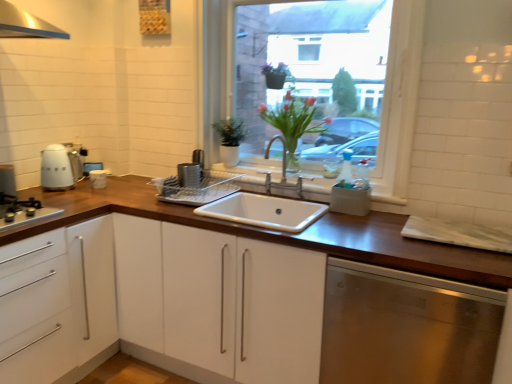
Question: Is white ceramic sink at center at the back of white glossy cabinet at left, placed as the first cabinetry when sorted from left to right?

Choices:
 (A) no
 (B) yes

Answer: (A)

Question: Does white glossy cabinet at left, the 2th cabinetry viewed from the right, lie in front of white ceramic sink at center?

Choices:
 (A) yes
 (B) no

Answer: (A)

Question: Considering the relative sizes of white glossy cabinet at left, the 2th cabinetry viewed from the right, and white ceramic sink at center in the image provided, is white glossy cabinet at left, the 2th cabinetry viewed from the right, wider than white ceramic sink at center?

Choices:
 (A) yes
 (B) no

Answer: (A)

Question: Is white glossy cabinet at left, the 2th cabinetry viewed from the right, completely or partially outside of white ceramic sink at center?

Choices:
 (A) no
 (B) yes

Answer: (B)

Question: Does white glossy cabinet at left, the 2th cabinetry viewed from the right, have a lesser height compared to white ceramic sink at center?

Choices:
 (A) yes
 (B) no

Answer: (B)

Question: From the image's perspective, does white glossy cabinet at left, the 2th cabinetry viewed from the right, appear lower than white ceramic sink at center?

Choices:
 (A) no
 (B) yes

Answer: (B)

Question: Is translucent glass vase at center facing towards white glossy cabinet at left, the 2th cabinetry viewed from the right?

Choices:
 (A) no
 (B) yes

Answer: (A)

Question: Is translucent glass vase at center wider than white glossy cabinet at left, the 2th cabinetry viewed from the right?

Choices:
 (A) yes
 (B) no

Answer: (B)

Question: From a real-world perspective, is translucent glass vase at center on white glossy cabinet at left, placed as the first cabinetry when sorted from left to right?

Choices:
 (A) yes
 (B) no

Answer: (A)

Question: Does translucent glass vase at center have a larger size compared to white glossy cabinet at left, the 2th cabinetry viewed from the right?

Choices:
 (A) yes
 (B) no

Answer: (B)

Question: Does translucent glass vase at center have a lesser height compared to white glossy cabinet at left, placed as the first cabinetry when sorted from left to right?

Choices:
 (A) no
 (B) yes

Answer: (B)

Question: Is translucent glass vase at center at the right side of white glossy cabinet at left, placed as the first cabinetry when sorted from left to right?

Choices:
 (A) yes
 (B) no

Answer: (A)

Question: Would you say white matte cabinet at center, which is the second cabinetry in left-to-right order, contains black matte gas stove at left?

Choices:
 (A) yes
 (B) no

Answer: (B)